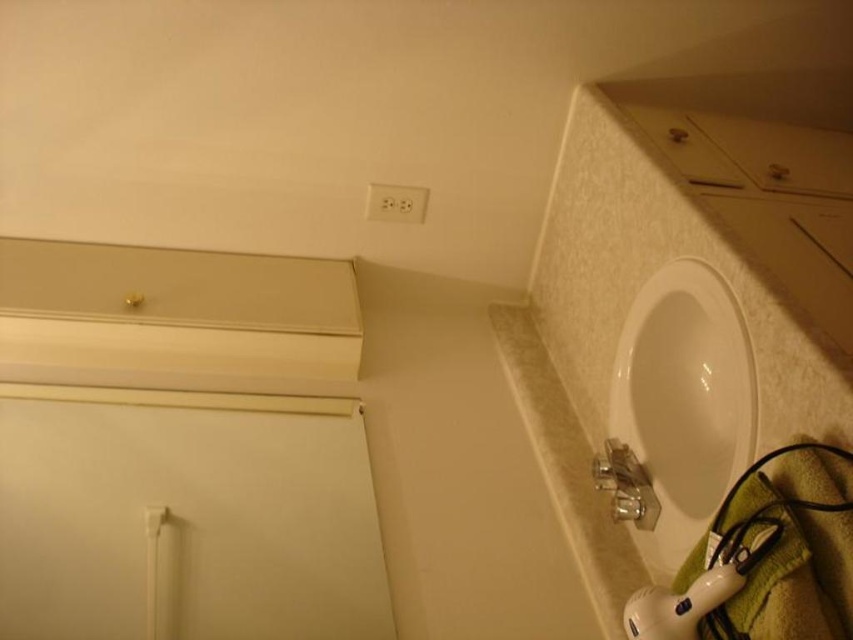
Consider the image. You are a plumber trying to fix a water pipe under the sink. You need to reach the white glossy sink at lower right. Is the white plastic outlet at upper center in your way?

The white glossy sink at lower right is located below the white plastic outlet at upper center, so the outlet is above the sink and not in your way during the repair work.

You are a plumber working in the bathroom. You need to check the height of the white glossy sink at lower right and the white plastic outlet at upper center. Which one has a greater height?

The white glossy sink at lower right is much taller than the white plastic outlet at upper center, so the white glossy sink at lower right has a greater height.